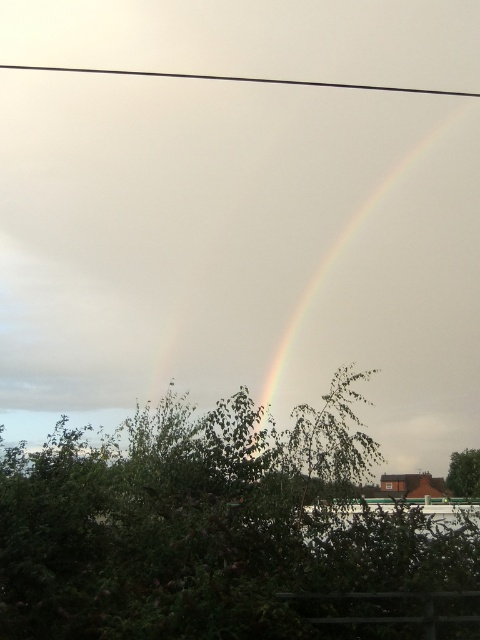
You are standing in the outdoor scene with the double rainbow and green foliage. You see two points marked in the image. Which point is closer to you, point (407, 196) or point (455, 452)?

Point (407, 196) is further to the camera than point (455, 452), so point (455, 452) is closer to you.

You are an artist trying to paint the scene. You want to place the green leafy tree at center and the rainbow at upper center in your painting. According to the scene, which object should be drawn first to ensure proper layering?

The green leafy tree at center should be drawn first because it is positioned on the left side of the rainbow at upper center, meaning it is closer to the viewer and needs to be layered in front.

You are an observer looking at the scene. You notice the black wire at upper center and the green leafy tree at lower right. Which object is taller in the image?

The black wire at upper center is taller than the green leafy tree at lower right according to the description.